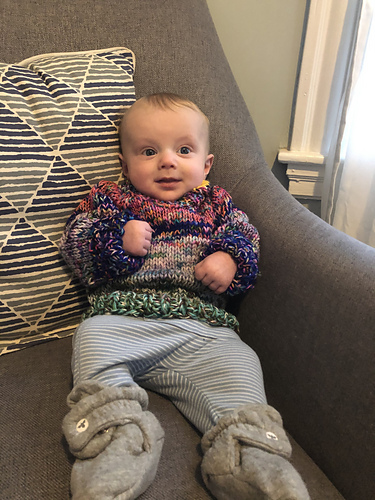
Locate an element on the screen. grey slippers is located at coordinates (119, 474), (263, 479).